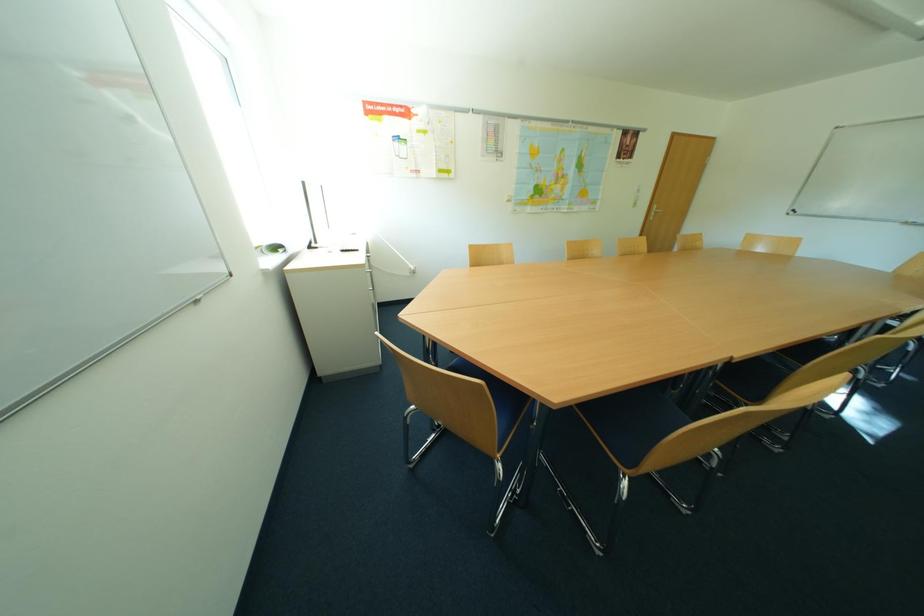
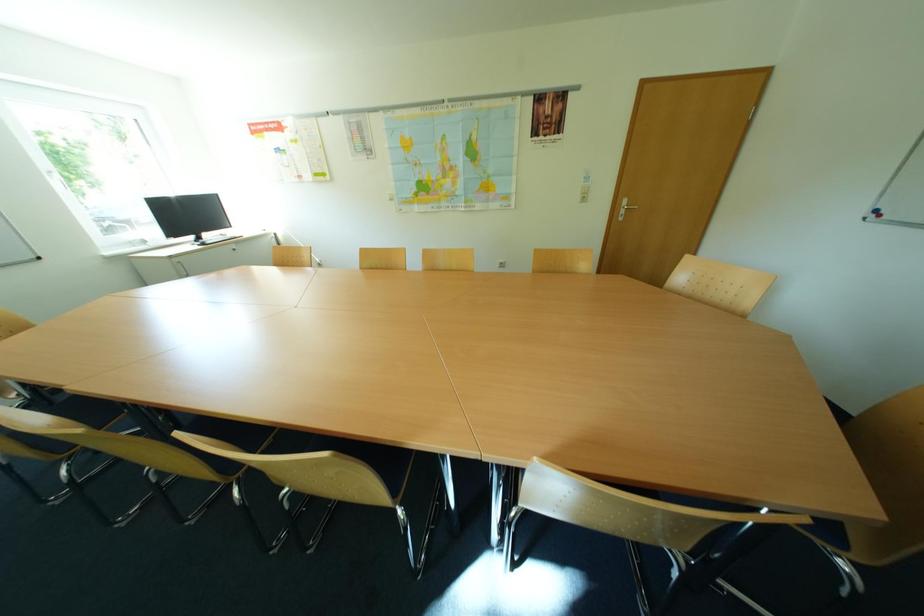
Question: Which direction would the cameraman need to move to produce the second image? Reply with the corresponding letter.

Choices:
 (A) Left
 (B) Right
 (C) Forward
 (D) Backward

Answer: (B)